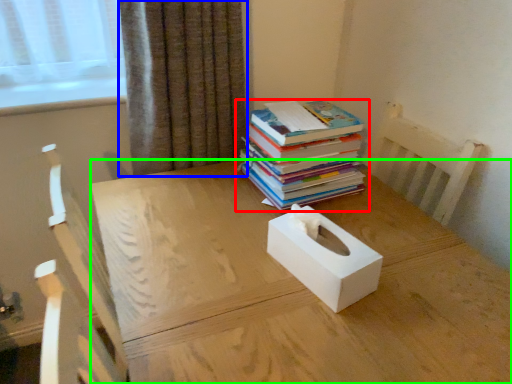
Question: Based on their relative distances, which object is nearer to book (highlighted by a red box)? Choose from curtain (highlighted by a blue box) and desk (highlighted by a green box).

Choices:
 (A) curtain
 (B) desk

Answer: (B)